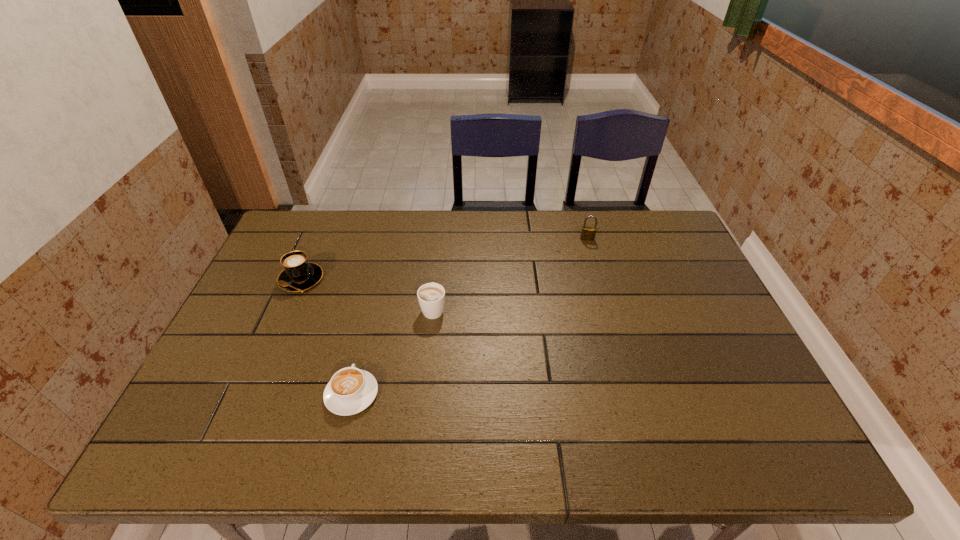
In order to click on unoccupied area between the third farthest object and the rightmost object in this screenshot , I will do `click(511, 274)`.

Image resolution: width=960 pixels, height=540 pixels. In order to click on empty location between the second object from right to left and the farthest cappuccino in this screenshot , I will do `click(367, 294)`.

This screenshot has width=960, height=540. I want to click on free space that is in between the rightmost cappuccino and the padlock, so click(511, 274).

I want to click on vacant area between the third object from left to right and the third object from right to left, so click(393, 352).

The image size is (960, 540). I want to click on free space between the rightmost cappuccino and the padlock, so click(x=511, y=274).

Select which object appears as the second closest to the farthest cappuccino. Please provide its 2D coordinates. Your answer should be formatted as a tuple, i.e. [(x, y)], where the tuple contains the x and y coordinates of a point satisfying the conditions above.

[(431, 296)]

Locate which object is the closest to the nearest cappuccino. Please provide its 2D coordinates. Your answer should be formatted as a tuple, i.e. [(x, y)], where the tuple contains the x and y coordinates of a point satisfying the conditions above.

[(431, 296)]

Find the location of a particular element. the closest cappuccino relative to the second cappuccino from right to left is located at coordinates (431, 296).

Locate an element on the screen. The width and height of the screenshot is (960, 540). cappuccino that is the closest to the leftmost object is located at coordinates (351, 390).

At what (x,y) coordinates should I click in order to perform the action: click on vacant space that satisfies the following two spatial constraints: 1. with the handle on the side of the rightmost object; 2. on the right side of the second nearest object. Please return your answer as a coordinate pair (x, y). Looking at the image, I should click on (441, 239).